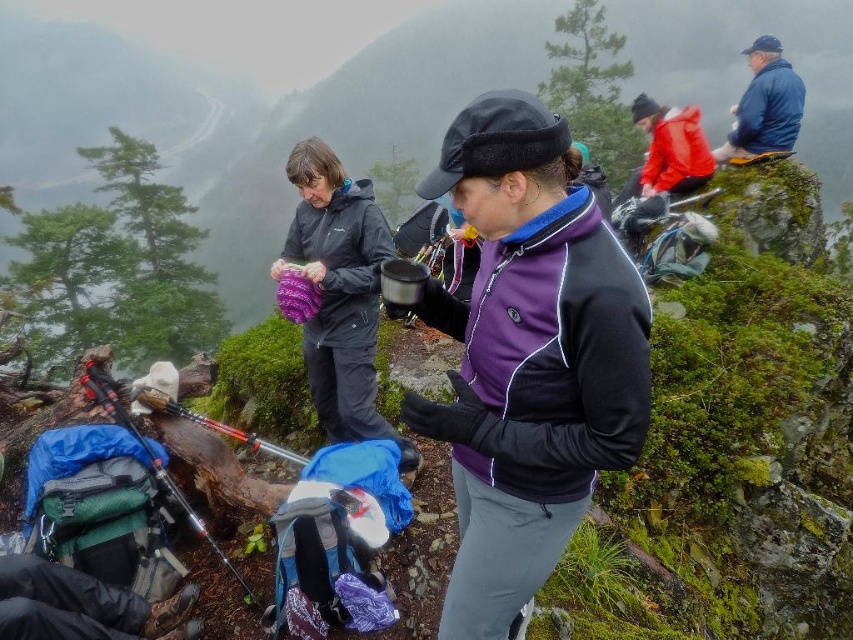
You are a hiker planning to take a photo of the purple fleece jacket at center and the green leafy tree at upper left. Based on their positions, which object is closer to the bottom of the image?

The purple fleece jacket at center is closer to the bottom of the image because it is positioned below the green leafy tree at upper left.

Looking at this image, you are a hiker who needs to pack your essentials. You see the matte purple bag at center and the green leafy tree at upper left in the scene. Which object is smaller in size?

The matte purple bag at center is smaller than the green leafy tree at upper left.